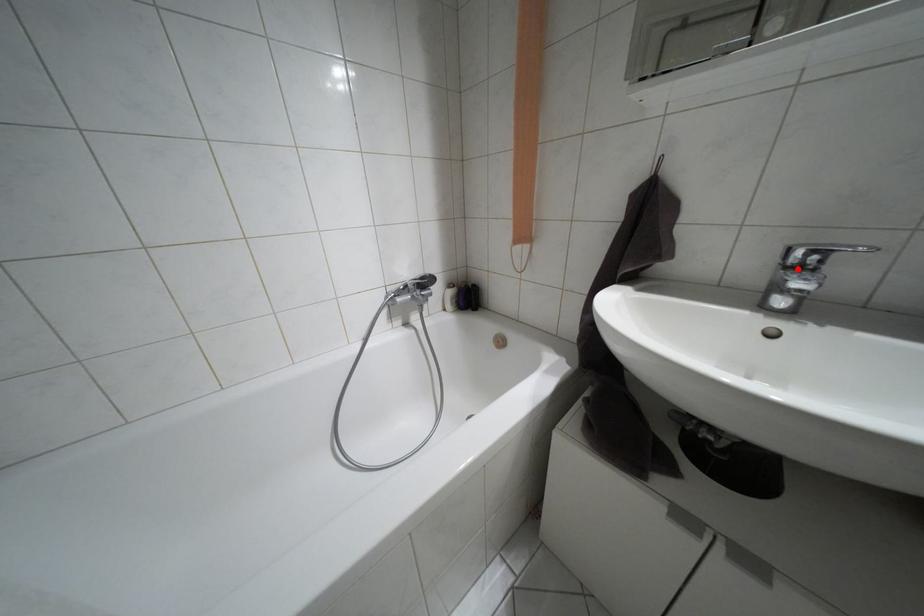
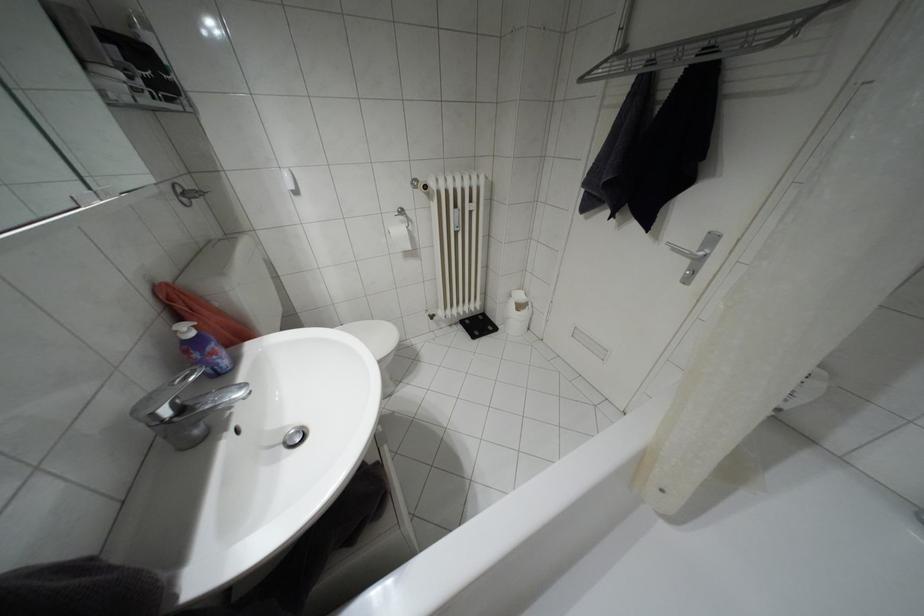
In the second image, find the point that corresponds to the highlighted location in the first image.

(180, 408)